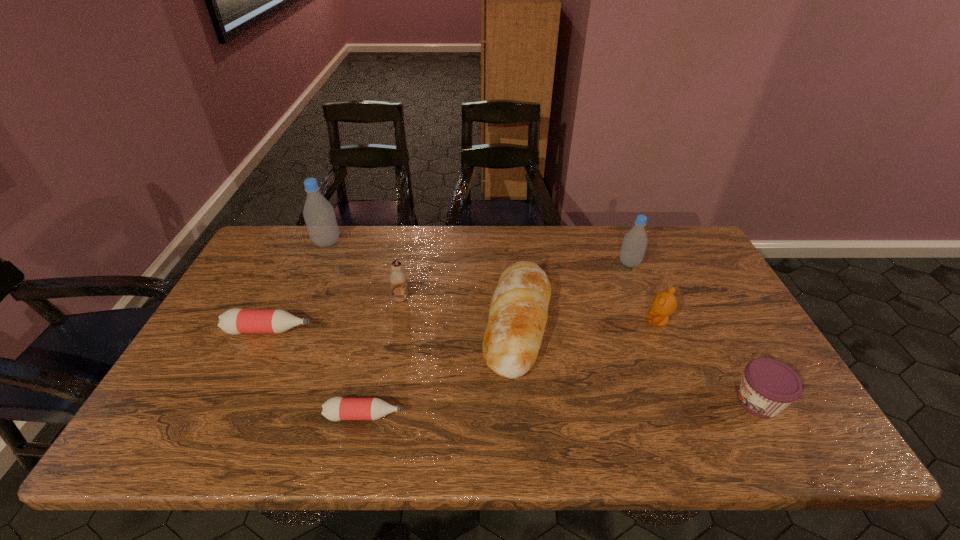
I want to click on vacant area situated 0.350m on the face of the teddy bear, so (x=520, y=321).

In order to click on free location located on the front label of the jam in this screenshot , I will do `click(593, 401)`.

Identify the location of vacant space situated on the front label of the jam. pos(670,401).

Identify the location of vacant space located 0.100m on the front label of the jam. (691, 401).

Identify the location of free space located with the cap open on the second shortest object. This screenshot has width=960, height=540. (375, 330).

Where is `vacant region located 0.210m with the cap open on the right pink bottle`? The height and width of the screenshot is (540, 960). vacant region located 0.210m with the cap open on the right pink bottle is located at coordinates (496, 415).

Identify the location of jam positioned at the near edge. The image size is (960, 540). (768, 386).

The image size is (960, 540). What are the coordinates of `bottle that is at the near edge` in the screenshot? It's located at (337, 408).

Locate an element on the screen. object present at the left edge is located at coordinates (235, 321).

Identify the location of object that is at the right edge. The width and height of the screenshot is (960, 540). (768, 386).